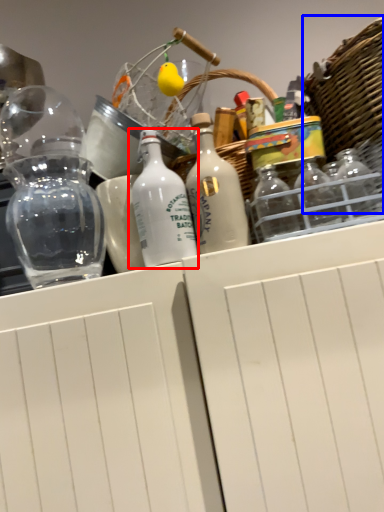
Question: Which point is closer to the camera, bottle (highlighted by a red box) or basket (highlighted by a blue box)?

Choices:
 (A) bottle
 (B) basket

Answer: (B)